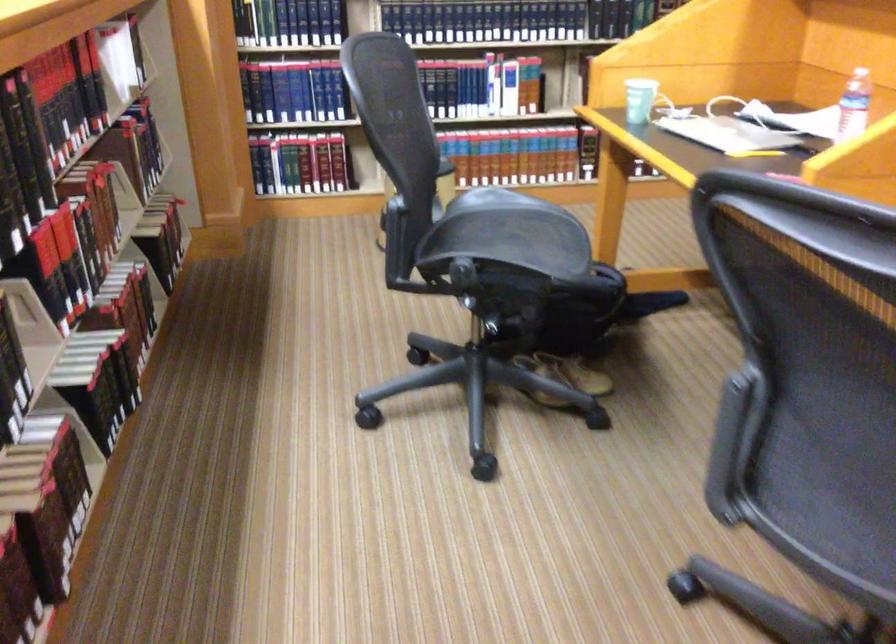
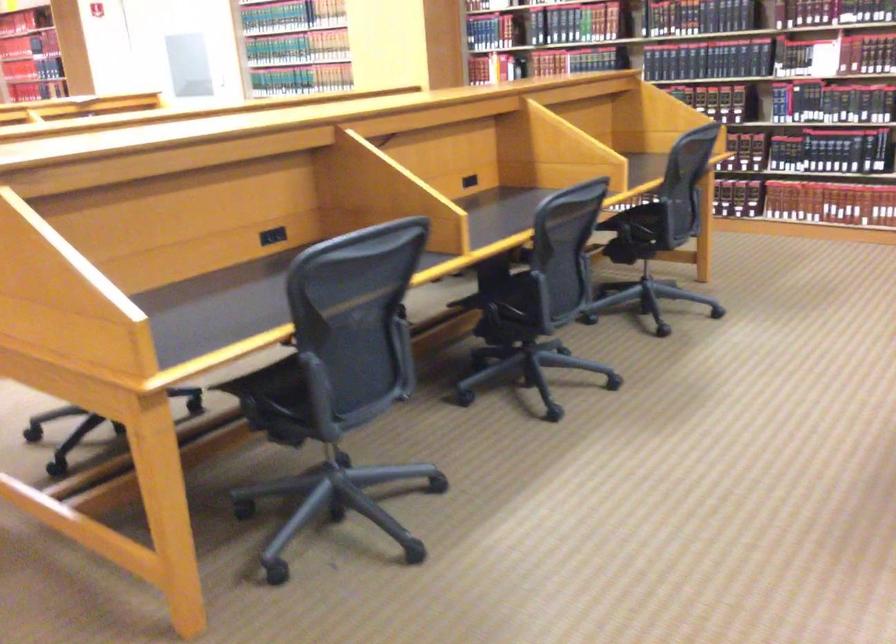
Question: I am providing you with two images of the same scene from different viewpoints. Please identify which objects are invisible in image2.

Choices:
 (A) black power outlet
 (B) chair sitting surface
 (C) chair armrest
 (D) small window figurine

Answer: (C)